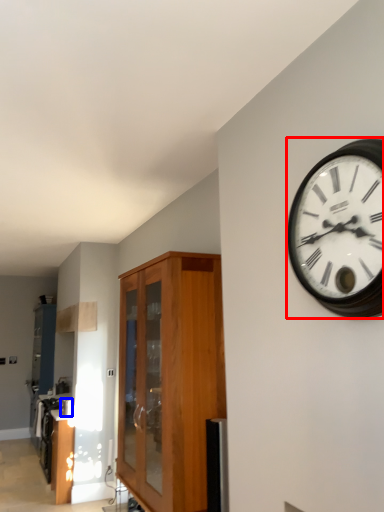
Question: Which object appears farthest to the camera in this image, wall clock (highlighted by a red box) or appliance (highlighted by a blue box)?

Choices:
 (A) wall clock
 (B) appliance

Answer: (B)